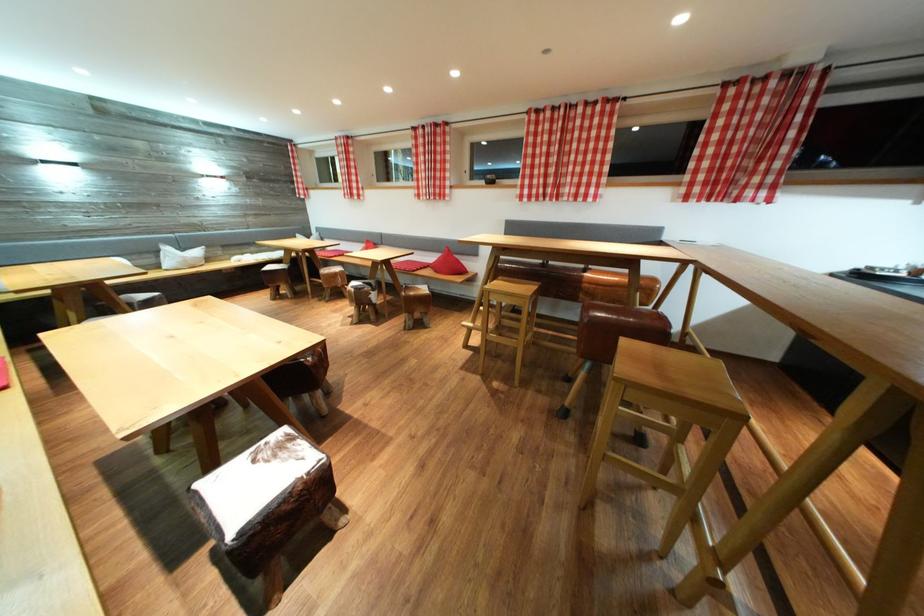
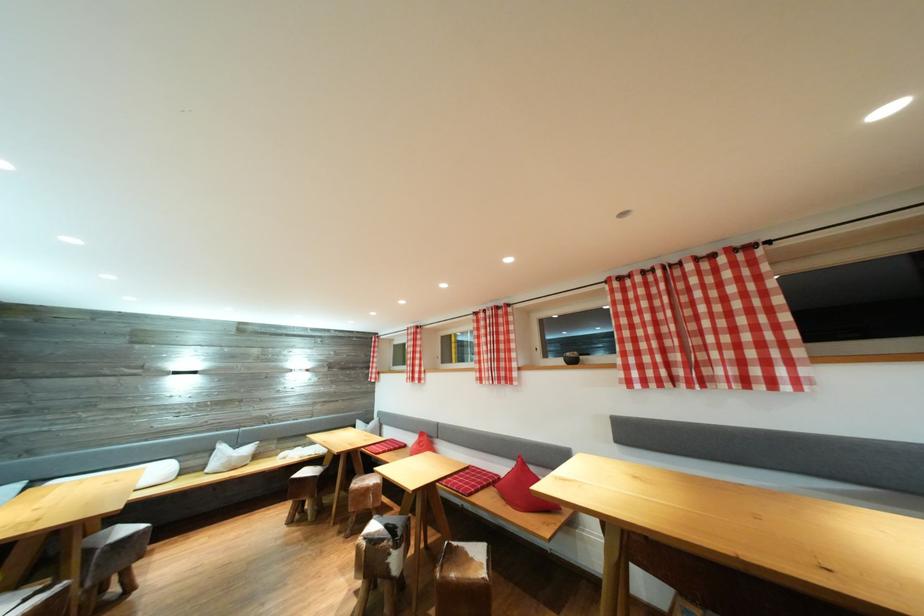
Locate, in the second image, the point that corresponds to (299,188) in the first image.

(375, 373)